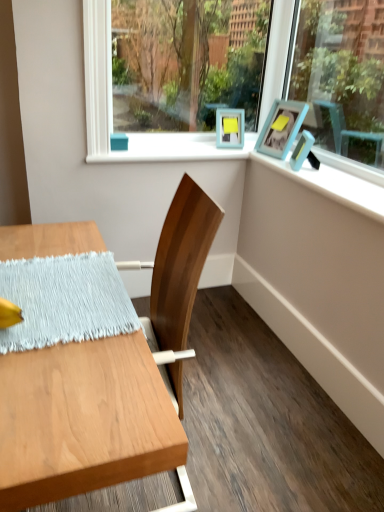
Question: In terms of width, does blue painted wood at upper right look wider or thinner when compared to clear glass window screen at upper center?

Choices:
 (A) wide
 (B) thin

Answer: (A)

Question: Is point (336, 199) positioned closer to the camera than point (170, 29)?

Choices:
 (A) closer
 (B) farther

Answer: (A)

Question: Estimate the real-world distances between objects in this image. Which object is farther from the blue painted wood at upper right?

Choices:
 (A) clear glass window screen at upper center
 (B) matte blue picture frame at upper right, arranged as the first picture frame when viewed from the front
 (C) wooden table at left
 (D) light blue woven placemat at left
 (E) teal matte picture frame at upper right, which ranks as the second picture frame in front-to-back order

Answer: (A)

Question: Which of these objects is positioned closest to the clear glass window screen at upper center?

Choices:
 (A) wooden table at left
 (B) matte blue picture frame at upper right, arranged as the first picture frame when viewed from the front
 (C) blue painted wood at upper right
 (D) light blue woven placemat at left
 (E) teal matte picture frame at upper right, the 1th picture frame positioned from the back

Answer: (E)